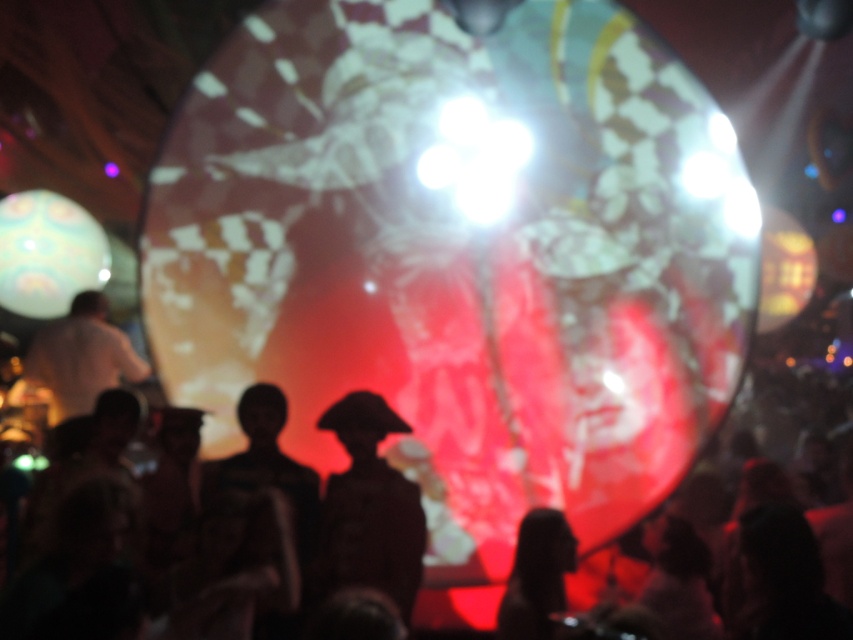
Is point (753, 422) behind point (422, 525)?

That is True.

Who is higher up, silhouette crowd at center or dark matte hat at center?

silhouette crowd at center is higher up.

Is point (848, 476) farther from camera compared to point (374, 557)?

That is True.

What are the coordinates of `silhouette crowd at center` in the screenshot? It's located at (767, 464).

Between silhouette crowd at center and silhouette head at lower center, which one appears on the left side from the viewer's perspective?

silhouette head at lower center

Consider the image. Is silhouette crowd at center thinner than silhouette head at lower center?

No, silhouette crowd at center is not thinner than silhouette head at lower center.

Does point (759, 492) come behind point (527, 561)?

Yes, point (759, 492) is farther from viewer.

Image resolution: width=853 pixels, height=640 pixels. What are the coordinates of `silhouette crowd at center` in the screenshot? It's located at (767, 464).

Which of these two, dark matte hat at center or silhouette head at lower center, stands taller?

dark matte hat at center

Between point (410, 544) and point (537, 554), which one is positioned behind?

Point (410, 544)

Where is `dark matte hat at center`? dark matte hat at center is located at coordinates (368, 509).